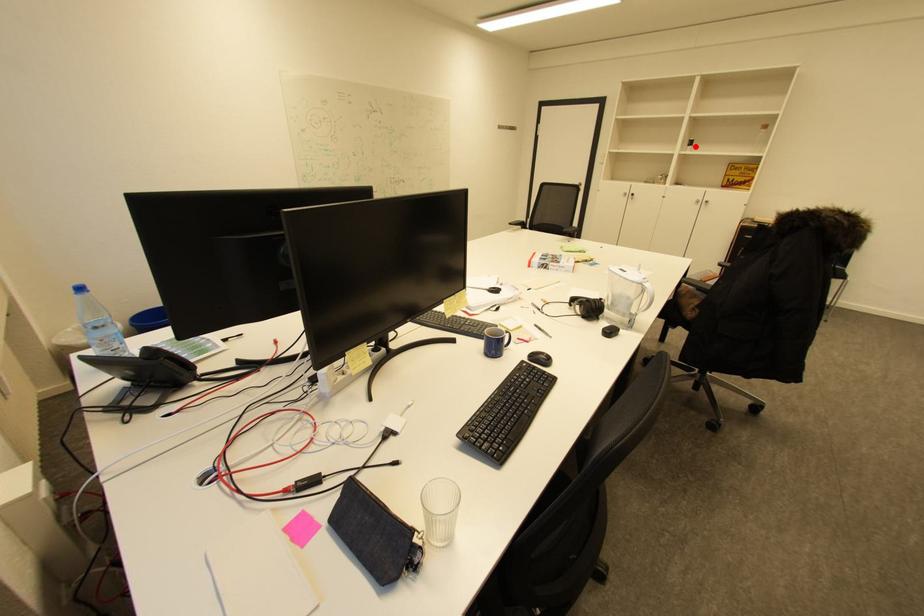
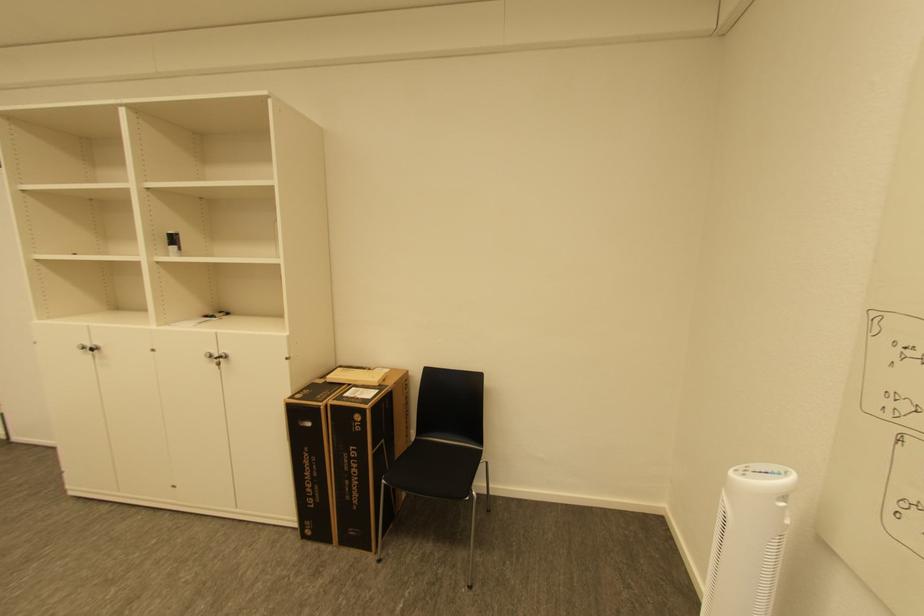
In the second image, find the point that corresponds to the highlighted location in the first image.

(176, 245)